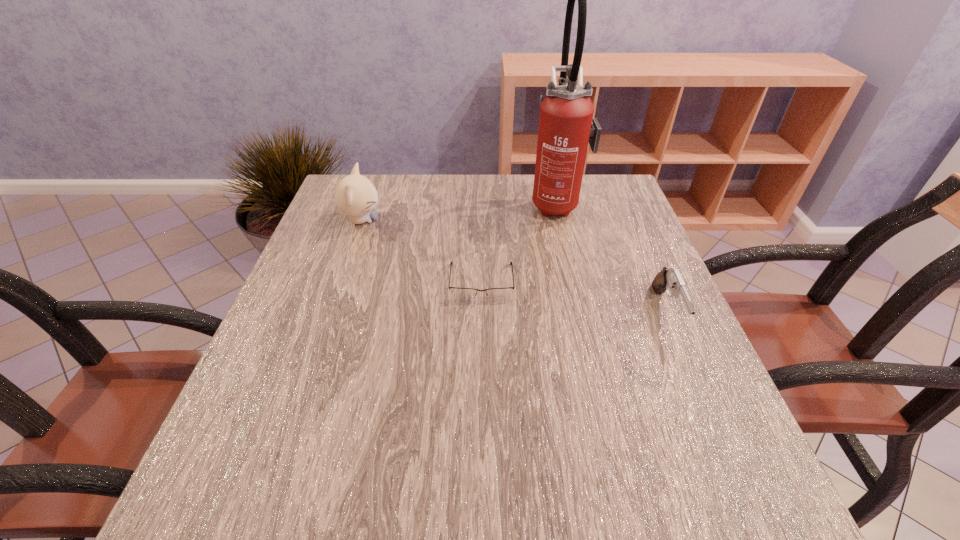
Identify the location of the second object from right to left. The width and height of the screenshot is (960, 540). (566, 125).

What are the coordinates of `fire extinguisher` in the screenshot? It's located at (566, 125).

The width and height of the screenshot is (960, 540). I want to click on the third shortest object, so click(355, 195).

The image size is (960, 540). Identify the location of the leftmost object. (355, 195).

Find the location of `the third tallest object`. the third tallest object is located at coordinates (670, 277).

Identify the location of the rightmost object. Image resolution: width=960 pixels, height=540 pixels. tap(670, 277).

Locate an element on the screen. spectacles is located at coordinates (459, 293).

Locate an element on the screen. the third object from right to left is located at coordinates (459, 293).

Image resolution: width=960 pixels, height=540 pixels. What are the coordinates of `vacant area situated at the nozzle of the tallest object` in the screenshot? It's located at (490, 204).

The image size is (960, 540). Identify the location of free space located at the nozzle of the tallest object. (426, 204).